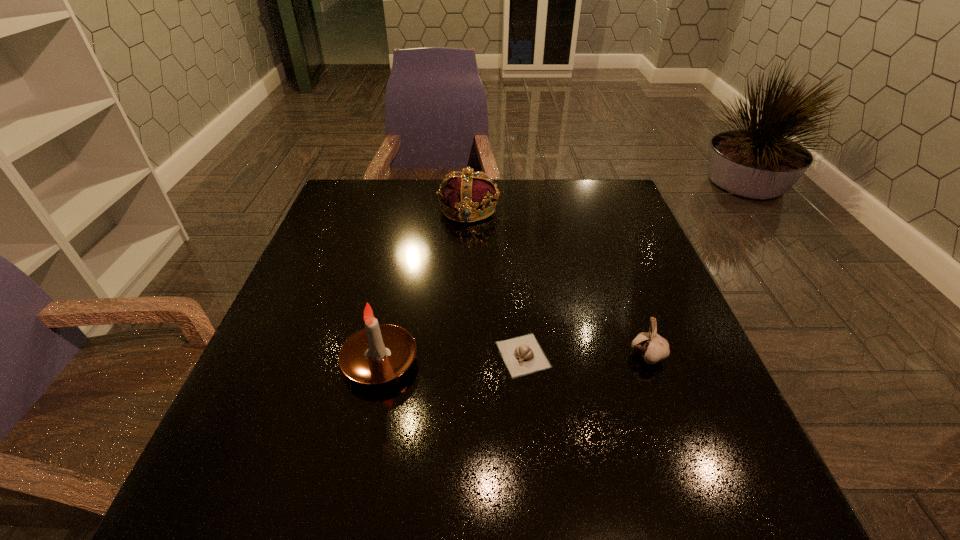
Identify the location of vacant area between the candle and the farthest object. (424, 285).

What are the coordinates of `free space between the crown and the left garlic` in the screenshot? It's located at (495, 282).

The width and height of the screenshot is (960, 540). I want to click on vacant space in between the shortest object and the right garlic, so click(x=586, y=356).

Where is `vacant point located between the shorter garlic and the second shortest object`? vacant point located between the shorter garlic and the second shortest object is located at coordinates (586, 356).

Find the location of a particular element. This screenshot has width=960, height=540. vacant point located between the candle and the second tallest object is located at coordinates (424, 285).

Where is `free space between the farthest object and the tallest object`? This screenshot has width=960, height=540. free space between the farthest object and the tallest object is located at coordinates (424, 285).

Locate an element on the screen. free space that is in between the right garlic and the shortest object is located at coordinates coord(586,356).

Identify the location of free space between the crown and the tallest object. (424, 285).

In order to click on the closest object to the farthest object in this screenshot , I will do `click(522, 355)`.

Point out which object is positioned as the third nearest to the third shortest object. Please provide its 2D coordinates. Your answer should be formatted as a tuple, i.e. [(x, y)], where the tuple contains the x and y coordinates of a point satisfying the conditions above.

[(653, 348)]